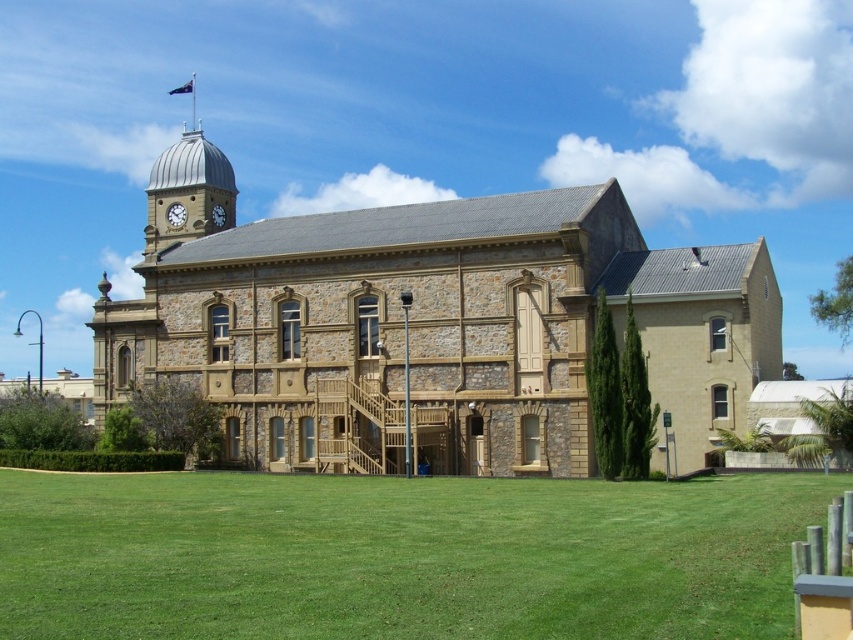
Question: Can you confirm if green grass at lower center is wider than matte silver clock at upper left?

Choices:
 (A) no
 (B) yes

Answer: (B)

Question: Does green grass at lower center come in front of matte silver clock at upper left?

Choices:
 (A) no
 (B) yes

Answer: (B)

Question: Which point is farther to the camera?

Choices:
 (A) matte silver clock at upper left
 (B) green grass at lower center

Answer: (A)

Question: Which point is farther to the camera?

Choices:
 (A) (61, 502)
 (B) (169, 204)

Answer: (B)

Question: Does green grass at lower center appear under matte silver clock at upper left?

Choices:
 (A) yes
 (B) no

Answer: (A)